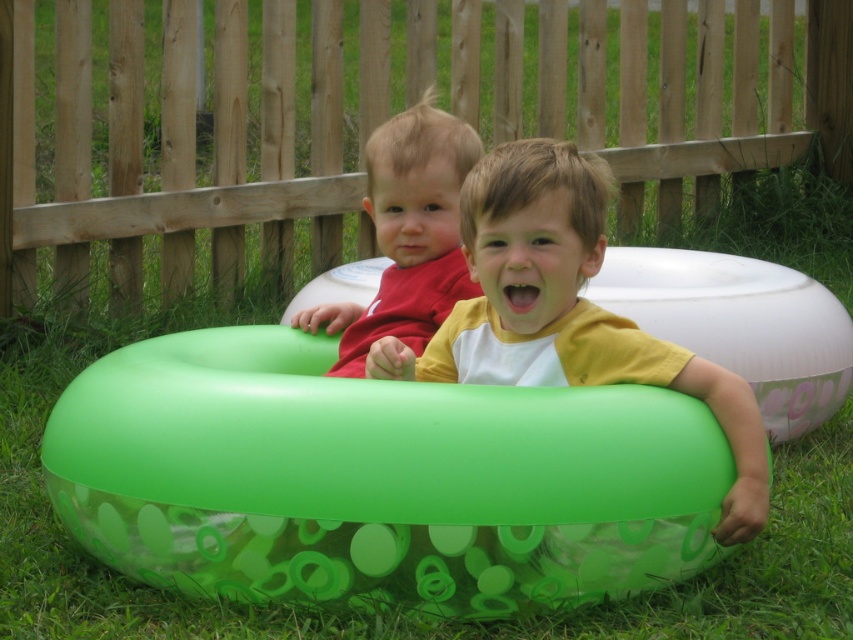
Does point (697, 568) come behind point (703, 396)?

Yes, it is behind point (703, 396).

The width and height of the screenshot is (853, 640). What do you see at coordinates (376, 480) in the screenshot?
I see `green rubber ring at center` at bounding box center [376, 480].

The image size is (853, 640). What do you see at coordinates (376, 480) in the screenshot?
I see `green rubber ring at center` at bounding box center [376, 480].

Locate an element on the screen. green rubber ring at center is located at coordinates (376, 480).

Is yellow matte shirt at center smaller than matte red shirt at center?

No, yellow matte shirt at center is not smaller than matte red shirt at center.

Is yellow matte shirt at center positioned behind matte red shirt at center?

No.

Between point (583, 202) and point (427, 97), which one is positioned behind?

The point (427, 97) is more distant.

Locate an element on the screen. The image size is (853, 640). yellow matte shirt at center is located at coordinates (566, 310).

Is the position of green rubber ring at center less distant than that of matte red shirt at center?

Yes, it is in front of matte red shirt at center.

Is the position of green rubber ring at center more distant than that of matte red shirt at center?

That is False.

The width and height of the screenshot is (853, 640). I want to click on green rubber ring at center, so click(x=376, y=480).